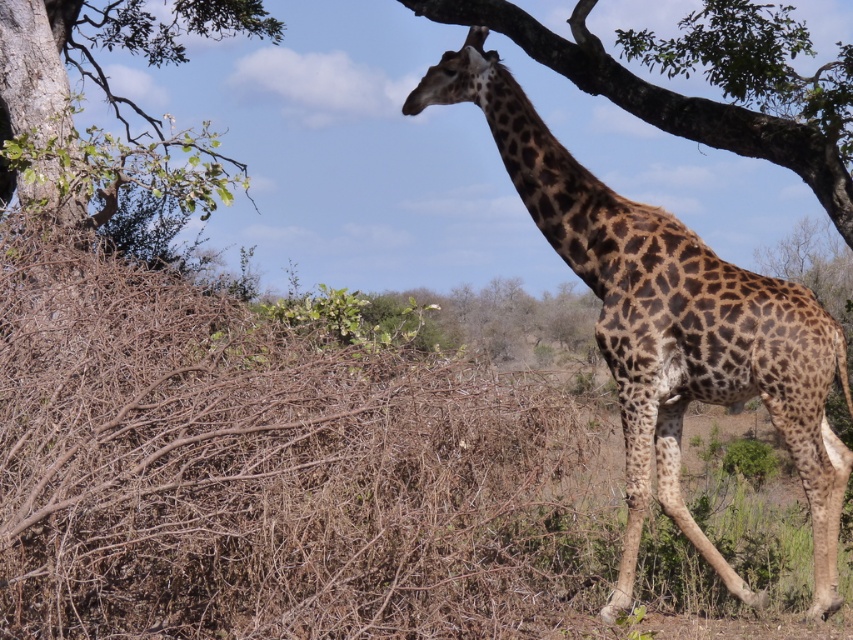
Question: Which point appears closest to the camera in this image?

Choices:
 (A) (78, 202)
 (B) (444, 93)

Answer: (B)

Question: Can you confirm if spotted fur giraffe at center is wider than green leafy tree at upper left?

Choices:
 (A) yes
 (B) no

Answer: (B)

Question: Can you confirm if spotted fur giraffe at center is positioned to the left of green leafy tree at upper left?

Choices:
 (A) yes
 (B) no

Answer: (B)

Question: From the image, what is the correct spatial relationship of spotted fur giraffe at center in relation to green leafy tree at upper left?

Choices:
 (A) above
 (B) below

Answer: (B)

Question: Which of the following is the farthest from the observer?

Choices:
 (A) (775, 323)
 (B) (225, 204)

Answer: (B)